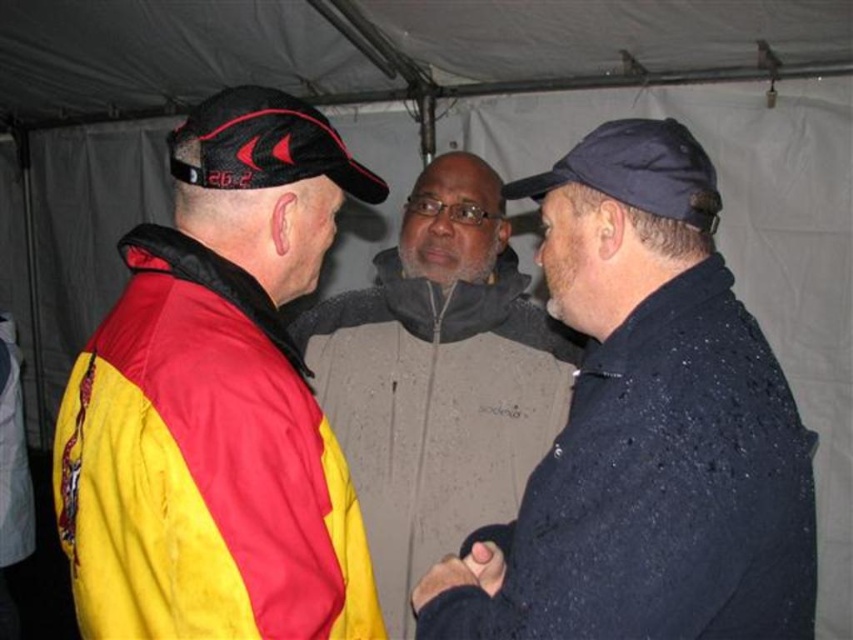
You are a photographer trying to capture the interaction between the two people under the tent. You notice the black leather glove at center and the black matte hand at center in your frame. Which object should you focus on if you want to highlight the larger one in your photo?

The black leather glove at center is taller than the black matte hand at center, so you should focus on the black leather glove at center to highlight the larger object in your photo.